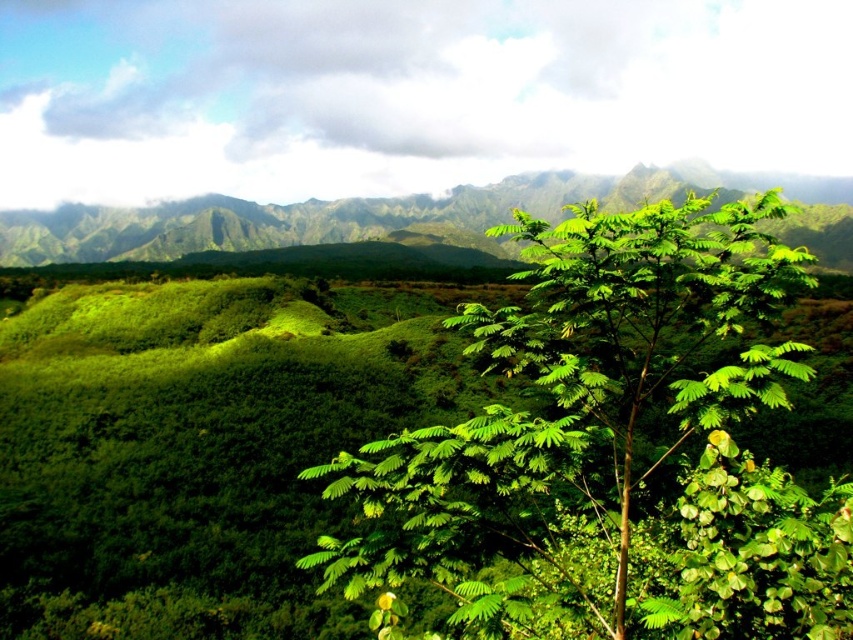
Measure the distance between green leafy tree at center and green leafy vegetation at center.

green leafy tree at center and green leafy vegetation at center are 279.45 meters apart from each other.

Between green leafy tree at center and green leafy vegetation at center, which one is positioned lower?

green leafy tree at center is lower down.

Where is `green leafy tree at center`? The width and height of the screenshot is (853, 640). green leafy tree at center is located at coordinates (613, 445).